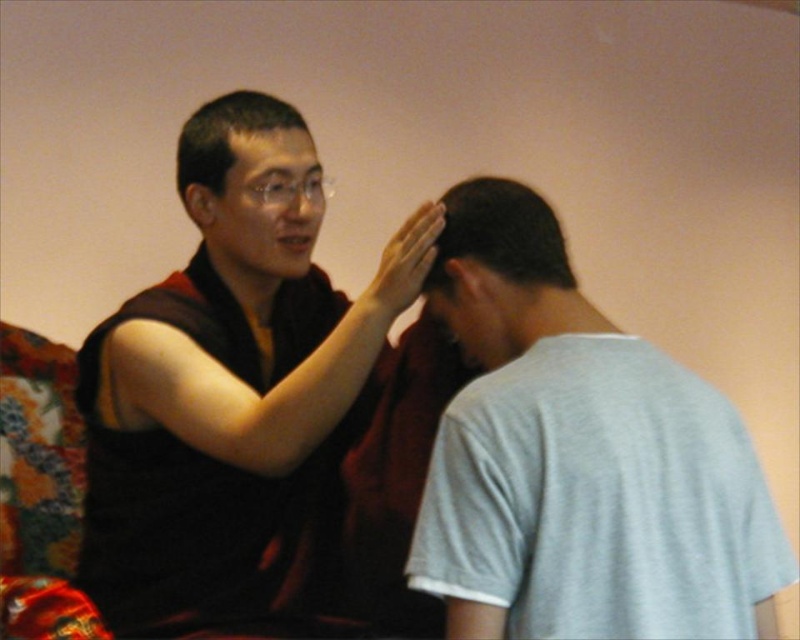
Question: Where is light gray cotton t-shirt at center located in relation to matte black robe at center in the image?

Choices:
 (A) above
 (B) below

Answer: (B)

Question: Among these points, which one is nearest to the camera?

Choices:
 (A) (738, 572)
 (B) (294, 156)
 (C) (197, 221)
 (D) (508, 193)

Answer: (A)

Question: Does dark brown hair at center appear over matte black hand at upper center?

Choices:
 (A) yes
 (B) no

Answer: (B)

Question: Among these points, which one is nearest to the camera?

Choices:
 (A) (366, 300)
 (B) (210, 188)
 (C) (454, 324)

Answer: (C)

Question: Is matte black robe at center to the left of matte black forehead at upper center from the viewer's perspective?

Choices:
 (A) no
 (B) yes

Answer: (B)

Question: Which point is closer to the camera?

Choices:
 (A) (184, 163)
 (B) (530, 211)

Answer: (B)